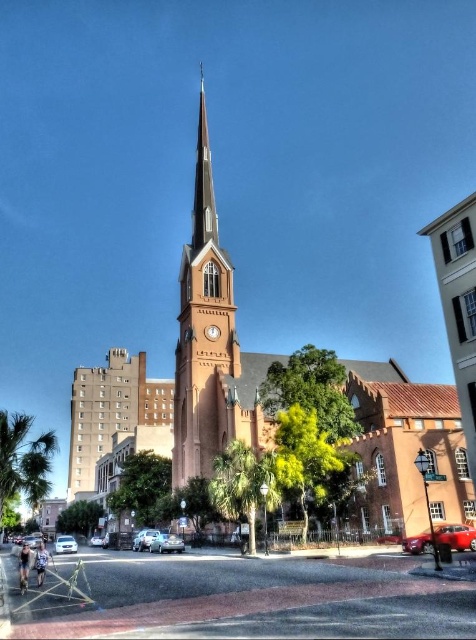
Who is taller, green leafy palm tree at lower left or metallic silver sedan at center?

green leafy palm tree at lower left is taller.

Which is above, green leafy palm tree at lower left or metallic silver sedan at center?

metallic silver sedan at center is higher up.

In order to click on green leafy palm tree at lower left in this screenshot , I will do `click(22, 460)`.

At what (x,y) coordinates should I click in order to perform the action: click on brick steeple at center. Please return your answer as a coordinate pair (x, y). Image resolution: width=476 pixels, height=640 pixels. Looking at the image, I should click on (202, 332).

Can you confirm if brick steeple at center is taller than metallic red car at lower right?

Indeed, brick steeple at center has a greater height compared to metallic red car at lower right.

Is point (206, 385) more distant than point (475, 531)?

That is True.

Image resolution: width=476 pixels, height=640 pixels. I want to click on brick steeple at center, so click(202, 332).

Based on the photo, between metallic clock at center and metallic silver car at center, which one appears on the right side from the viewer's perspective?

From the viewer's perspective, metallic clock at center appears more on the right side.

Is the position of metallic clock at center more distant than that of metallic silver car at center?

That is False.

Is point (210, 337) more distant than point (91, 538)?

No, it is in front of (91, 538).

You are a GUI agent. You are given a task and a screenshot of the screen. Output one action in this format:
    pyautogui.click(x=<x>, y=<y>)
    Task: Click on the metallic clock at center
    
    Given the screenshot: What is the action you would take?
    pyautogui.click(x=211, y=332)